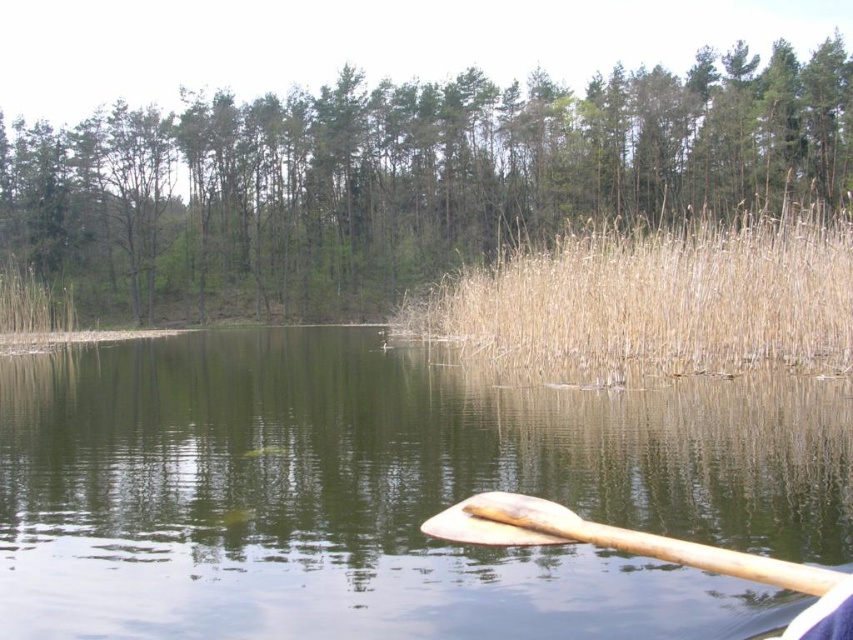
You are an environmental scientist analyzing the spatial distribution of vegetation in the lakeside area. You observe the green matte tree at upper center and the dry grass at center. Which vegetation has a greater horizontal spread in the image?

The green matte tree at upper center has a greater horizontal spread than the dry grass at center, as its width surpasses that of the dry grass.

You are standing at the lakeside and see two points marked in the scene. Which point is closer to you, point (221, 273) or point (534, 269)?

Point (221, 273) is closer to you because it is further to the viewer than point (534, 269).